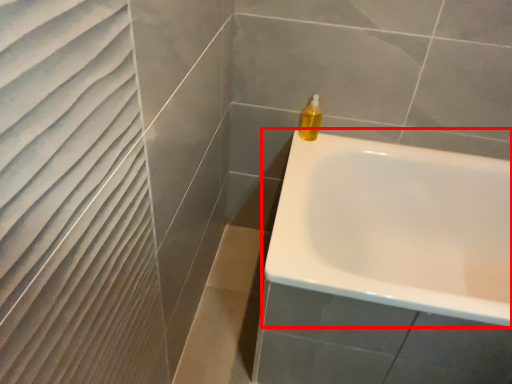
Question: From the image, what is the correct spatial relationship of bathtub (annotated by the red box) in relation to soap dispenser?

Choices:
 (A) left
 (B) right

Answer: (B)